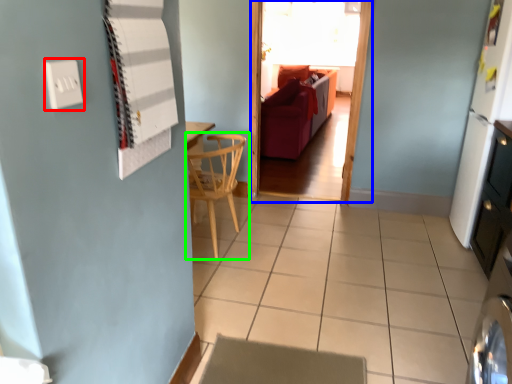
Question: Which object is positioned closest to electric outlet (highlighted by a red box)? Select from glass door (highlighted by a blue box) and chair (highlighted by a green box).

Choices:
 (A) glass door
 (B) chair

Answer: (B)